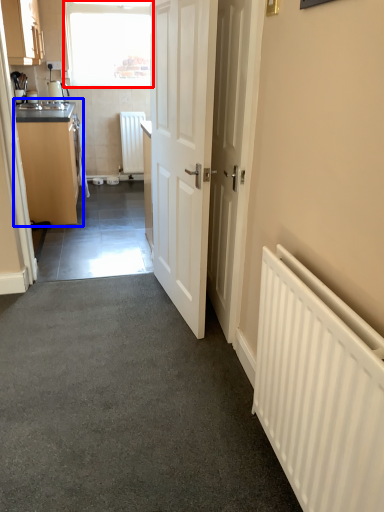
Question: Which of the following is the farthest to the observer, window (highlighted by a red box) or cabinetry (highlighted by a blue box)?

Choices:
 (A) window
 (B) cabinetry

Answer: (A)